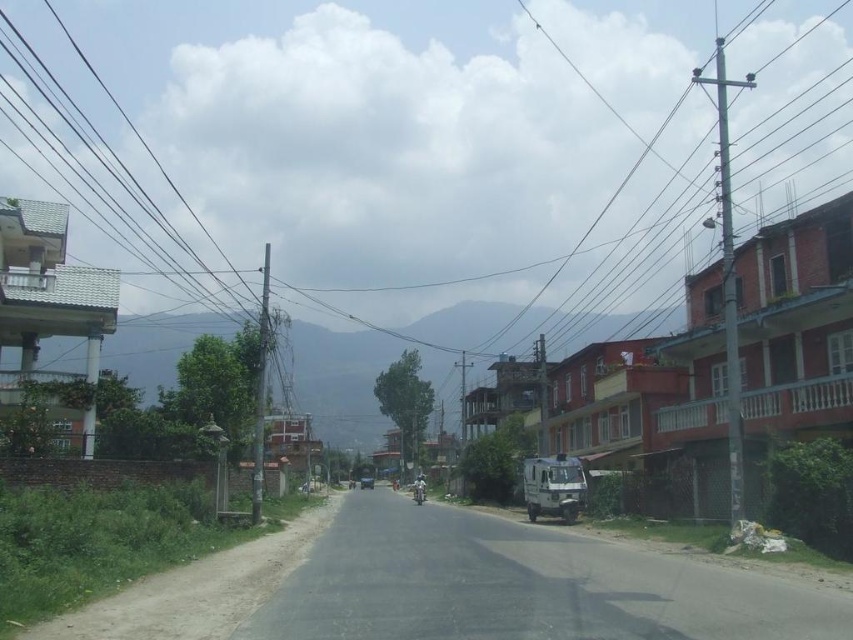
You are a delivery person who needs to park your vehicle on the street. You see a shiny chrome motorcycle at center and a metallic blue car at center. Which vehicle is positioned higher up in the image?

The shiny chrome motorcycle at center is located above the metallic blue car at center, so it is positioned higher up in the image.

You are a delivery person who needs to park your vehicle on the street. You have a shiny chrome motorcycle at center and a metallic blue car at center. Which vehicle should you choose to park closer to the right side of the street?

The shiny chrome motorcycle at center is to the right of metallic blue car at center, so choosing the shiny chrome motorcycle at center would allow you to park closer to the right side of the street.